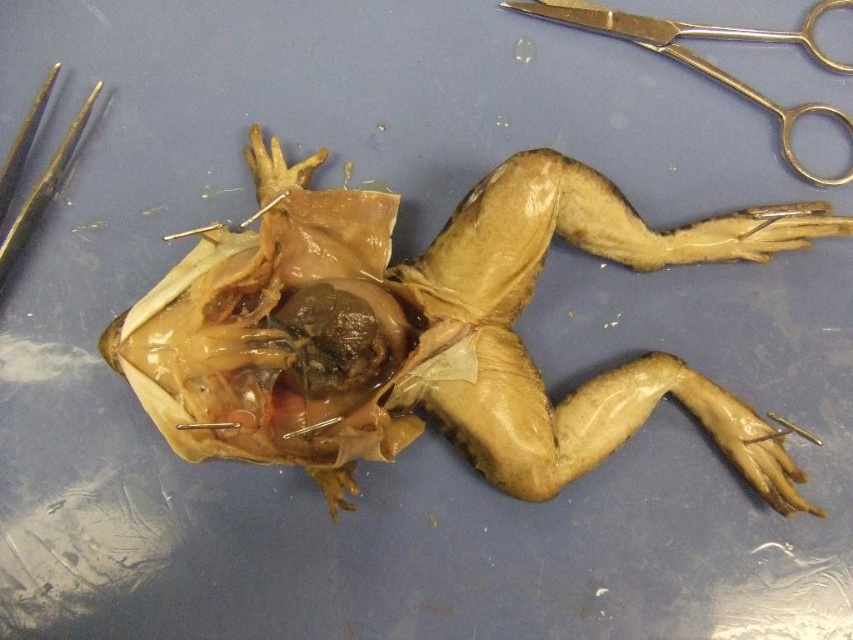
Question: Is satin silver scissors at upper right positioned at the back of gold metallic forceps at upper left?

Choices:
 (A) no
 (B) yes

Answer: (B)

Question: Which object appears farthest from the camera in this image?

Choices:
 (A) translucent flesh at center
 (B) satin silver scissors at upper right
 (C) gold metallic forceps at upper left

Answer: (B)

Question: Among these points, which one is farthest from the camera?

Choices:
 (A) (16, 243)
 (B) (845, 67)
 (C) (277, 273)

Answer: (B)

Question: Is translucent flesh at center positioned behind gold metallic forceps at upper left?

Choices:
 (A) no
 (B) yes

Answer: (A)

Question: Which point appears closest to the camera in this image?

Choices:
 (A) (44, 205)
 (B) (142, 384)

Answer: (B)

Question: Does translucent flesh at center have a smaller size compared to gold metallic forceps at upper left?

Choices:
 (A) yes
 (B) no

Answer: (B)